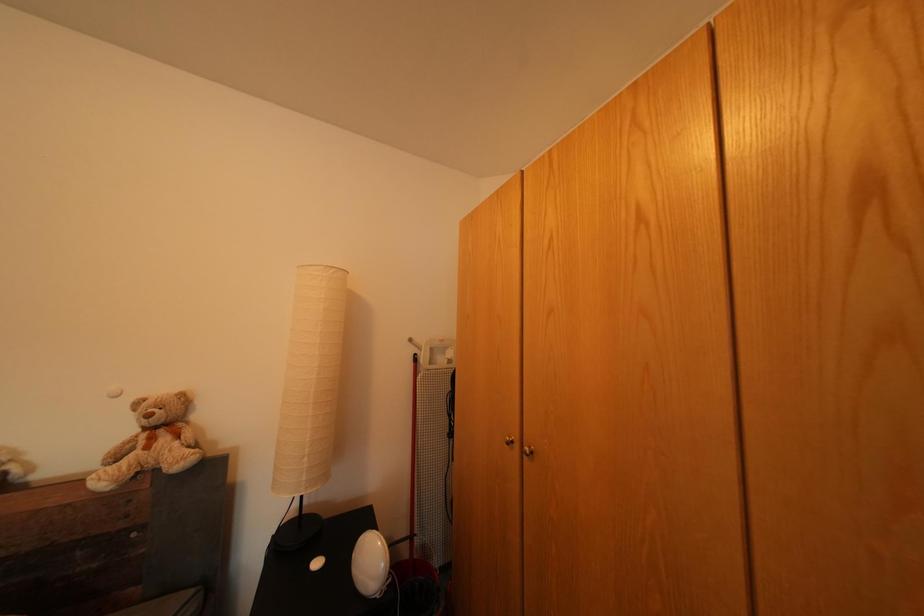
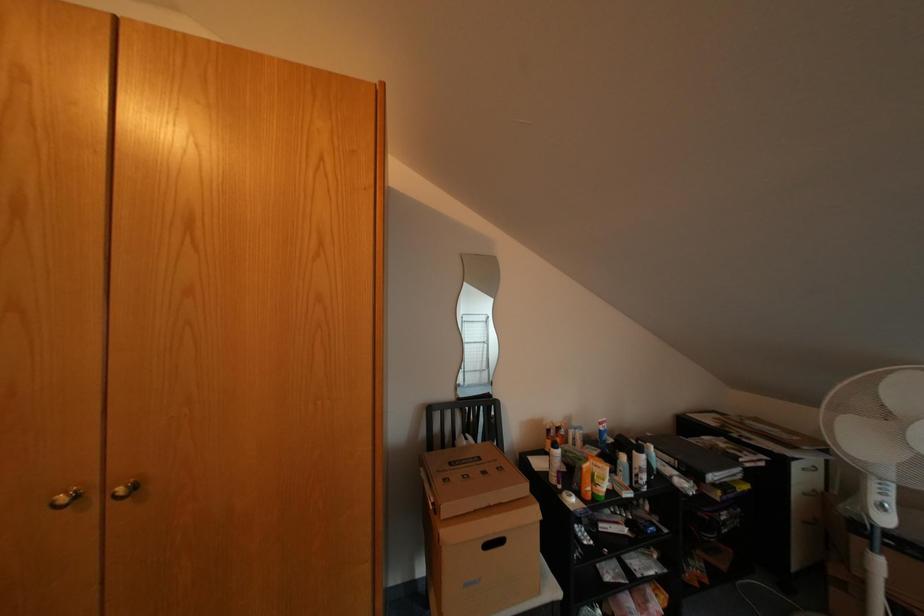
Question: Based on the continuous images, in which direction is the camera rotating? Reply with the corresponding letter.

Choices:
 (A) Left
 (B) Right
 (C) Up
 (D) Down

Answer: (B)